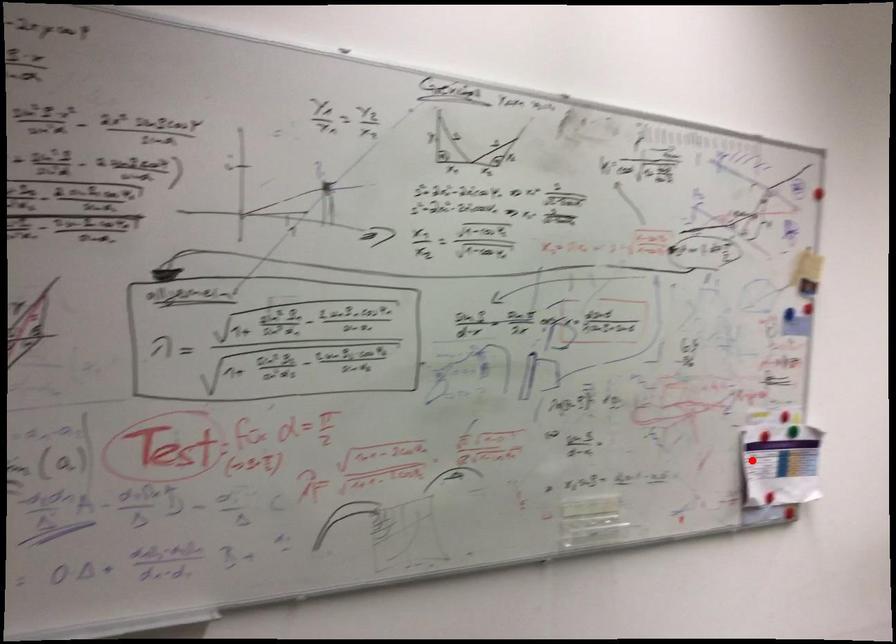
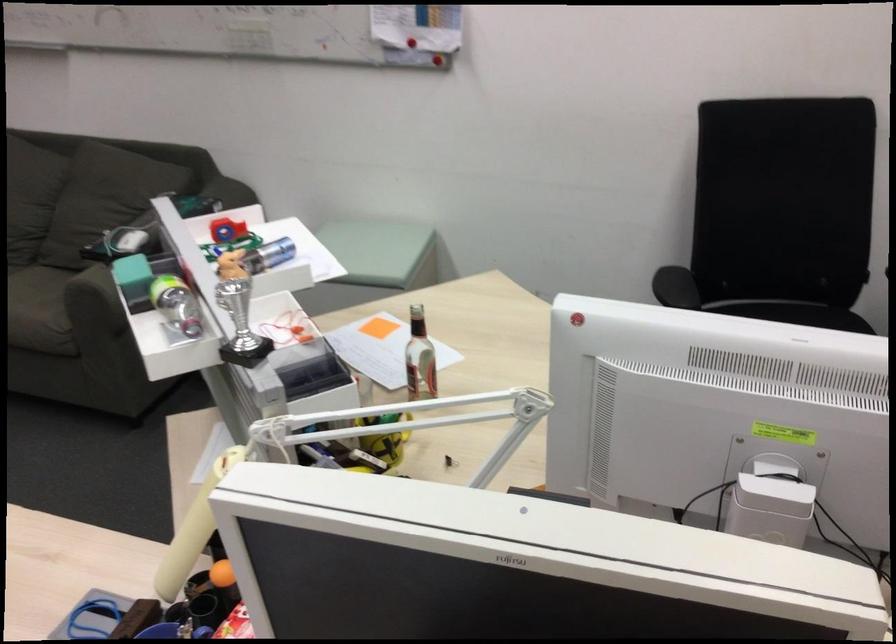
The point at the highlighted location is marked in the first image. Where is the corresponding point in the second image?

(401, 13)